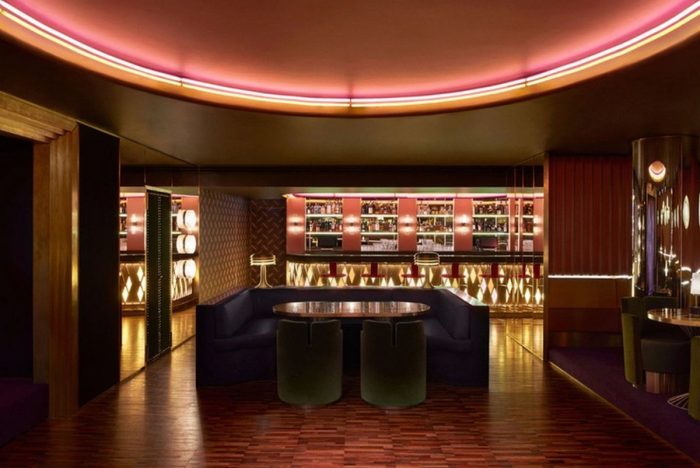
Where is `right table cylinder stand`? This screenshot has height=468, width=700. right table cylinder stand is located at coordinates (402, 375).